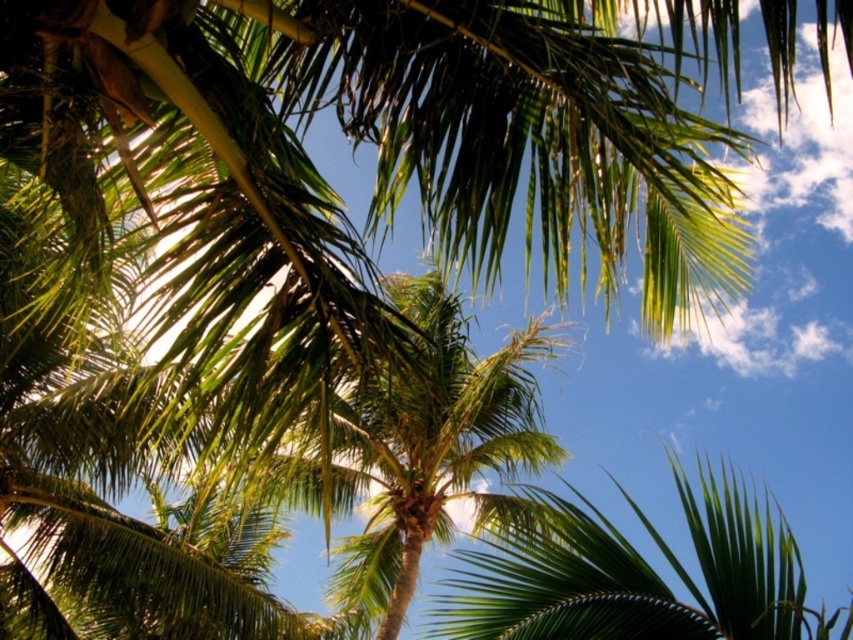
Does green leafy palm tree at center lie behind green leafy palm at center?

No, it is in front of green leafy palm at center.

Is green leafy palm tree at center bigger than green leafy palm at center?

Correct, green leafy palm tree at center is larger in size than green leafy palm at center.

Who is more distant from viewer, (415, 374) or (506, 561)?

Point (506, 561)

The height and width of the screenshot is (640, 853). I want to click on green leafy palm tree at center, so click(431, 448).